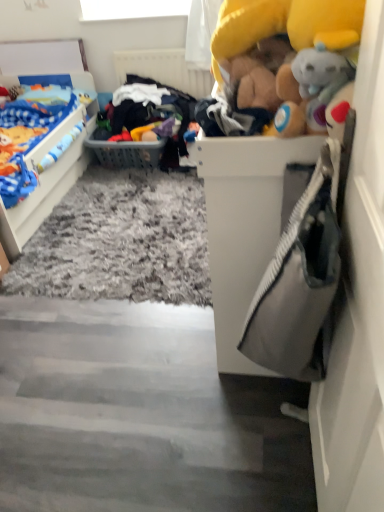
You are a GUI agent. You are given a task and a screenshot of the screen. Output one action in this format:
    pyautogui.click(x=<x>, y=<y>)
    Task: Click on the vacant point above white textured radiator at upper center (from a real-world perspective)
    
    Given the screenshot: What is the action you would take?
    pyautogui.click(x=157, y=44)